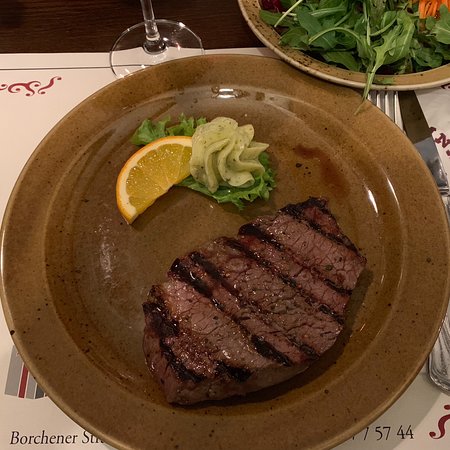
Where is `glass`? glass is located at coordinates (146, 35).